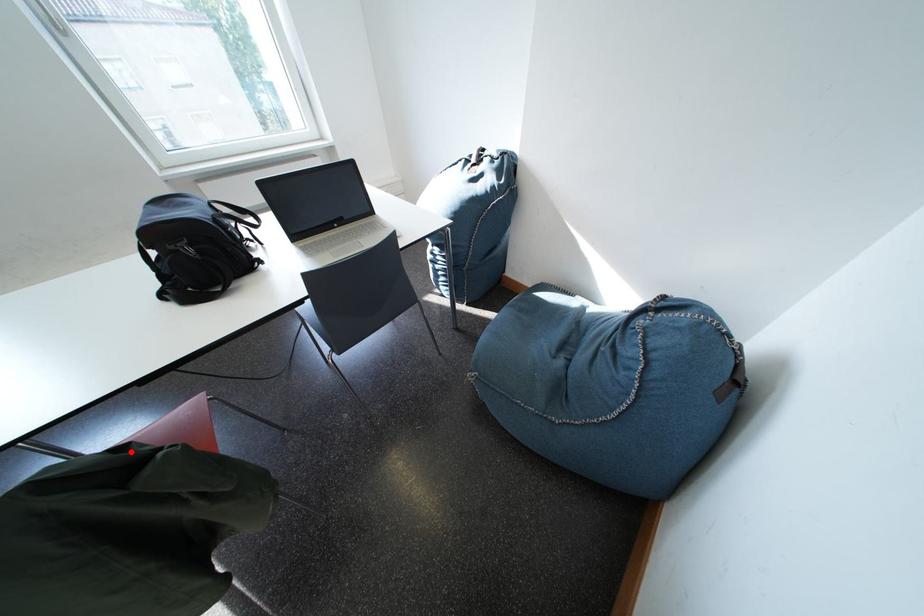
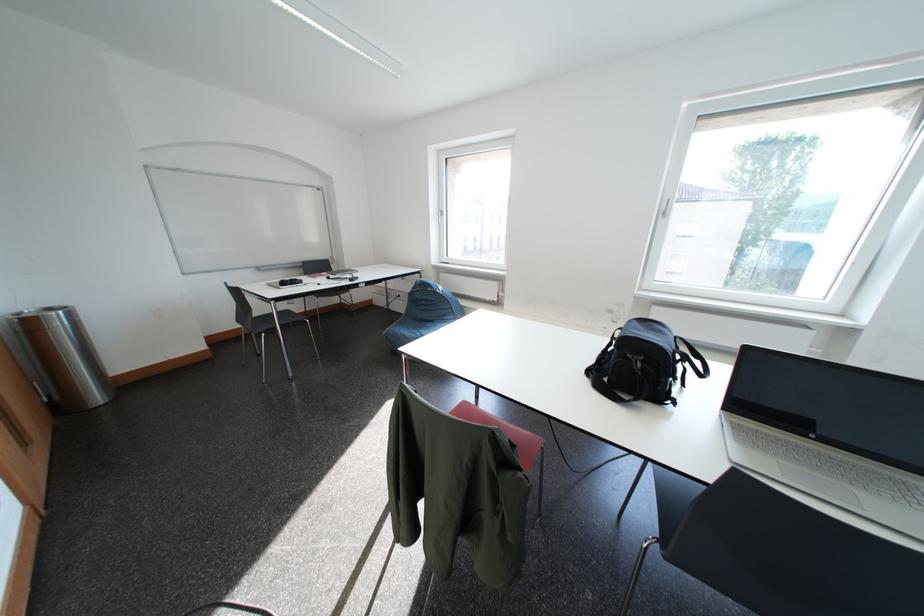
Where in the second image is the point corresponding to the highlighted location from the first image?

(525, 450)